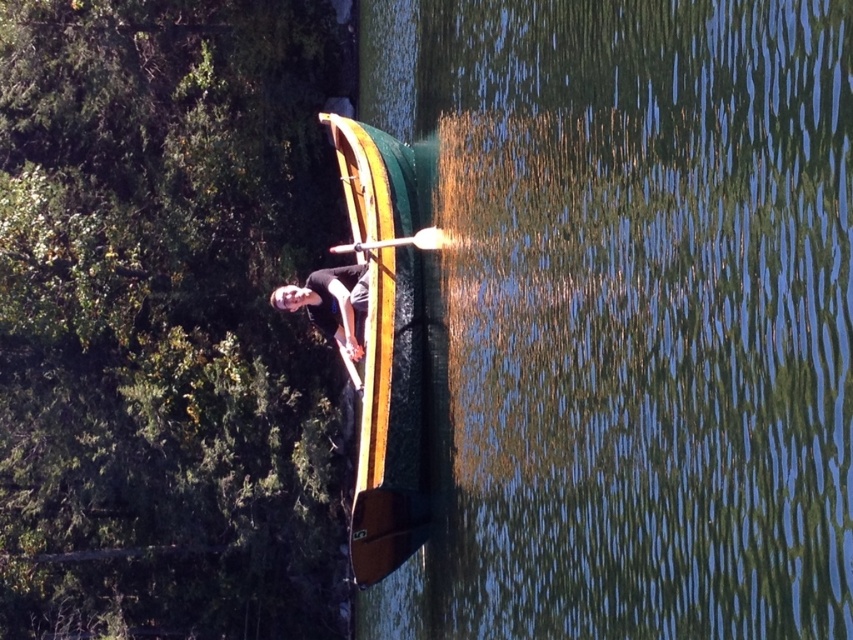
Based on the photo, who is more forward, (842, 220) or (283, 305)?

Point (842, 220) is more forward.

Who is positioned more to the right, green smooth water at center or matte black shirt at center?

green smooth water at center is more to the right.

Between point (462, 448) and point (363, 282), which one is positioned in front?

Point (462, 448) is more forward.

Locate an element on the screen. The image size is (853, 640). green smooth water at center is located at coordinates (628, 316).

Is green leafy tree at upper left to the left of green polished wood boat at center from the viewer's perspective?

Indeed, green leafy tree at upper left is positioned on the left side of green polished wood boat at center.

Is green leafy tree at upper left to the right of green polished wood boat at center from the viewer's perspective?

In fact, green leafy tree at upper left is to the left of green polished wood boat at center.

I want to click on green leafy tree at upper left, so (x=166, y=320).

Does green polished wood boat at center have a greater width compared to wooden paddle at center?

No.

Is point (402, 234) positioned before point (395, 243)?

That is False.

This screenshot has height=640, width=853. What do you see at coordinates (386, 349) in the screenshot? I see `green polished wood boat at center` at bounding box center [386, 349].

You are a GUI agent. You are given a task and a screenshot of the screen. Output one action in this format:
    pyautogui.click(x=<x>, y=<y>)
    Task: Click on the green polished wood boat at center
    This screenshot has height=640, width=853.
    Given the screenshot: What is the action you would take?
    pyautogui.click(x=386, y=349)